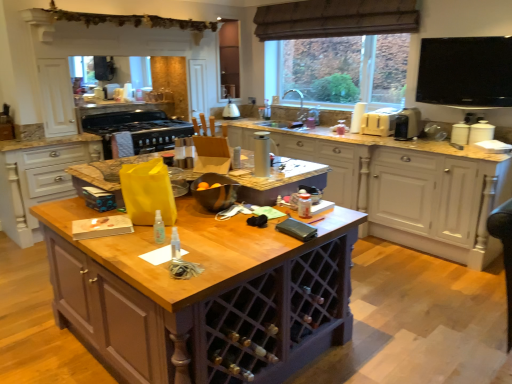
Question: Is transparent plastic spray bottle at center to the right of beige plastic toaster at upper right, the 3th appliance when ordered from back to front, from the viewer's perspective?

Choices:
 (A) yes
 (B) no

Answer: (B)

Question: From the image's perspective, does transparent plastic spray bottle at center appear higher than beige plastic toaster at upper right, which is counted as the 5th appliance, starting from the front?

Choices:
 (A) yes
 (B) no

Answer: (B)

Question: From the image's perspective, is transparent plastic spray bottle at center under beige plastic toaster at upper right, the 3th appliance when ordered from back to front?

Choices:
 (A) yes
 (B) no

Answer: (A)

Question: Is transparent plastic spray bottle at center far from beige plastic toaster at upper right, which is counted as the 5th appliance, starting from the front?

Choices:
 (A) yes
 (B) no

Answer: (A)

Question: From a real-world perspective, is transparent plastic spray bottle at center beneath beige plastic toaster at upper right, the 3th appliance when ordered from back to front?

Choices:
 (A) no
 (B) yes

Answer: (B)

Question: Is white ceramic canister at right, positioned as the 4th appliance in back-to-front order, taller or shorter than black matte stove at upper left, positioned as the second appliance in back-to-front order?

Choices:
 (A) short
 (B) tall

Answer: (B)

Question: Is white ceramic canister at right, acting as the sixth appliance starting from the left, bigger or smaller than black matte stove at upper left, which is counted as the 7th appliance, starting from the right?

Choices:
 (A) small
 (B) big

Answer: (A)

Question: From the image's perspective, is white ceramic canister at right, positioned as the 4th appliance in back-to-front order, positioned above or below black matte stove at upper left, which is counted as the 7th appliance, starting from the right?

Choices:
 (A) below
 (B) above

Answer: (A)

Question: Is white ceramic canister at right, positioned as the 4th appliance in back-to-front order, in front of or behind black matte stove at upper left, positioned as the first appliance in left-to-right order, in the image?

Choices:
 (A) behind
 (B) front

Answer: (B)

Question: Considering the positions of silver metallic thermos at center, which ranks as the fourth appliance in left-to-right order, and black matte stove at upper left, positioned as the first appliance in left-to-right order, in the image, is silver metallic thermos at center, which ranks as the fourth appliance in left-to-right order, taller or shorter than black matte stove at upper left, positioned as the first appliance in left-to-right order,?

Choices:
 (A) short
 (B) tall

Answer: (B)

Question: From the image's perspective, is silver metallic thermos at center, the fourth appliance when ordered from right to left, located above or below black matte stove at upper left, the 6th appliance from the front?

Choices:
 (A) below
 (B) above

Answer: (A)

Question: From a real-world perspective, relative to black matte stove at upper left, the 6th appliance from the front, is silver metallic thermos at center, the fourth appliance when ordered from right to left, vertically above or below?

Choices:
 (A) above
 (B) below

Answer: (A)

Question: Is silver metallic thermos at center, arranged as the 2th appliance when viewed from the front, in front of or behind black matte stove at upper left, positioned as the second appliance in back-to-front order, in the image?

Choices:
 (A) front
 (B) behind

Answer: (A)

Question: Considering the relative positions of wooden cabinet at center, the third cabinetry from the right, and brown textured curtain at upper center in the image provided, is wooden cabinet at center, the third cabinetry from the right, to the left or to the right of brown textured curtain at upper center?

Choices:
 (A) right
 (B) left

Answer: (B)

Question: From the image's perspective, is wooden cabinet at center, the third cabinetry from the right, positioned above or below brown textured curtain at upper center?

Choices:
 (A) below
 (B) above

Answer: (A)